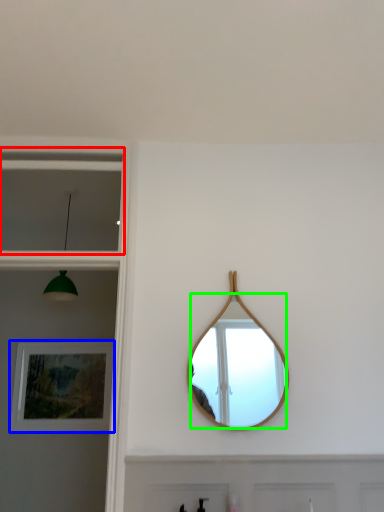
Question: Which object is positioned farthest from window (highlighted by a red box)? Select from picture frame (highlighted by a blue box) and mirror (highlighted by a green box).

Choices:
 (A) picture frame
 (B) mirror

Answer: (B)